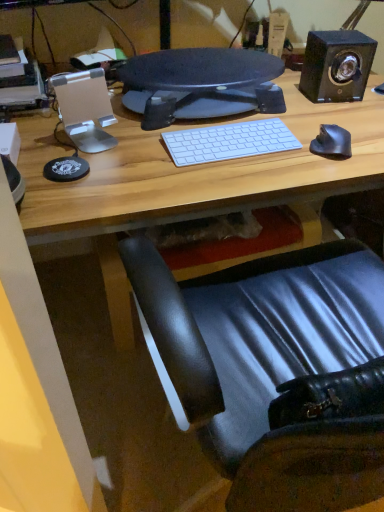
Question: Is matte black monitor at center turned away from black rubberized mouse at right?

Choices:
 (A) no
 (B) yes

Answer: (A)

Question: Could black rubberized mouse at right be considered to be inside matte black monitor at center?

Choices:
 (A) no
 (B) yes

Answer: (A)

Question: Considering the relative sizes of matte black monitor at center and black rubberized mouse at right in the image provided, is matte black monitor at center shorter than black rubberized mouse at right?

Choices:
 (A) yes
 (B) no

Answer: (B)

Question: Is matte black monitor at center placed right next to black rubberized mouse at right?

Choices:
 (A) yes
 (B) no

Answer: (B)

Question: From the image's perspective, would you say matte black monitor at center is shown under black rubberized mouse at right?

Choices:
 (A) yes
 (B) no

Answer: (B)

Question: In terms of size, does white matte keyboard at center appear bigger or smaller than black glossy speaker at upper right?

Choices:
 (A) big
 (B) small

Answer: (B)

Question: From a real-world perspective, relative to black glossy speaker at upper right, is white matte keyboard at center vertically above or below?

Choices:
 (A) above
 (B) below

Answer: (B)

Question: Considering the positions of white matte keyboard at center and black glossy speaker at upper right in the image, is white matte keyboard at center taller or shorter than black glossy speaker at upper right?

Choices:
 (A) short
 (B) tall

Answer: (A)

Question: From the image's perspective, is white matte keyboard at center above or below black glossy speaker at upper right?

Choices:
 (A) above
 (B) below

Answer: (B)

Question: In terms of width, does white matte keyboard at center look wider or thinner when compared to black leather chair at lower right?

Choices:
 (A) thin
 (B) wide

Answer: (A)

Question: Choose the correct answer: Is white matte keyboard at center inside black leather chair at lower right or outside it?

Choices:
 (A) outside
 (B) inside

Answer: (A)

Question: Looking at the image, does white matte keyboard at center seem bigger or smaller compared to black leather chair at lower right?

Choices:
 (A) small
 (B) big

Answer: (A)

Question: From a real-world perspective, relative to black leather chair at lower right, is white matte keyboard at center vertically above or below?

Choices:
 (A) above
 (B) below

Answer: (A)

Question: From a real-world perspective, is black glossy speaker at upper right physically located above or below matte black monitor at center?

Choices:
 (A) above
 (B) below

Answer: (A)

Question: From the image's perspective, is black glossy speaker at upper right located above or below matte black monitor at center?

Choices:
 (A) above
 (B) below

Answer: (A)